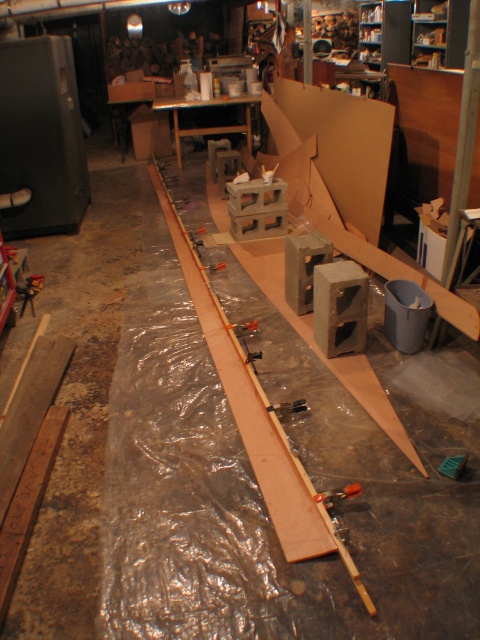
From the picture: Is matte gray concrete blocks at center in front of metallic silver clamp at center?

That is False.

I want to click on matte gray concrete blocks at center, so click(212, 125).

Identify the location of matte gray concrete blocks at center. The image size is (480, 640). (212, 125).

You are a GUI agent. You are given a task and a screenshot of the screen. Output one action in this format:
    pyautogui.click(x=<x>, y=<y>)
    Task: Click on the matte gray concrete blocks at center
    The height and width of the screenshot is (640, 480).
    Given the screenshot: What is the action you would take?
    (x=212, y=125)

In the scene shown: Is matte gray concrete blocks at center below metallic silver screwdriver at center?

No.

Can you confirm if matte gray concrete blocks at center is taller than metallic silver screwdriver at center?

Yes.

Who is more forward, (240, 96) or (316, 497)?

Point (316, 497) is more forward.

Identify the location of matte gray concrete blocks at center. (212, 125).

Does metallic silver screwdriver at center appear under metallic silver clamp at center?

Yes.

Is metallic silver screwdriver at center in front of metallic silver clamp at center?

Yes, metallic silver screwdriver at center is closer to the viewer.

This screenshot has height=640, width=480. I want to click on metallic silver screwdriver at center, so click(337, 493).